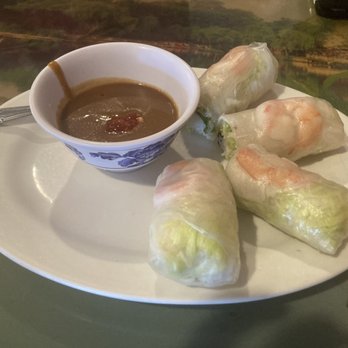
Locate an element on the screen. The height and width of the screenshot is (348, 348). small bowl is located at coordinates (112, 55).